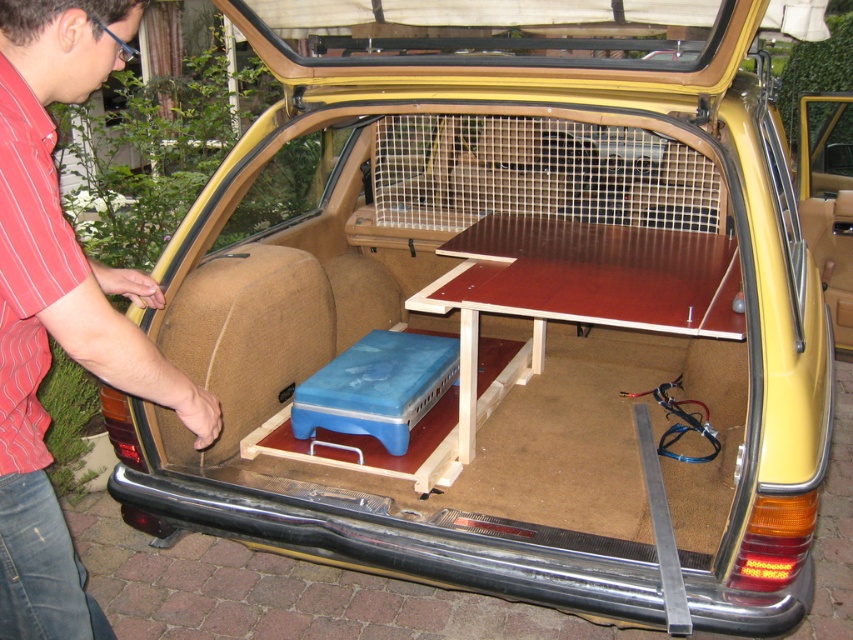
You are packing for a picnic and need to place your red striped shirt at left and brown wooden picnic table at center into a storage box. The box can only hold items within 4 feet of each other. Will both items fit into the box?

The red striped shirt at left is 4.32 feet away from the brown wooden picnic table at center, which exceeds the 4 feet limit. Therefore, both items cannot fit into the box together.

In the scene shown: You are organizing items in the car trunk and notice the red striped shirt at left and the brown wooden picnic table at center. Which item is closer to you when you open the trunk?

The red striped shirt at left is closer to you because it is in front of the brown wooden picnic table at center when the trunk is opened.

You are packing for a picnic and have a red striped shirt at left and a brown wooden picnic table at center in the car trunk. Which item takes up more space horizontally?

The brown wooden picnic table at center takes up more space horizontally than the red striped shirt at left because the red striped shirt at left is thinner.